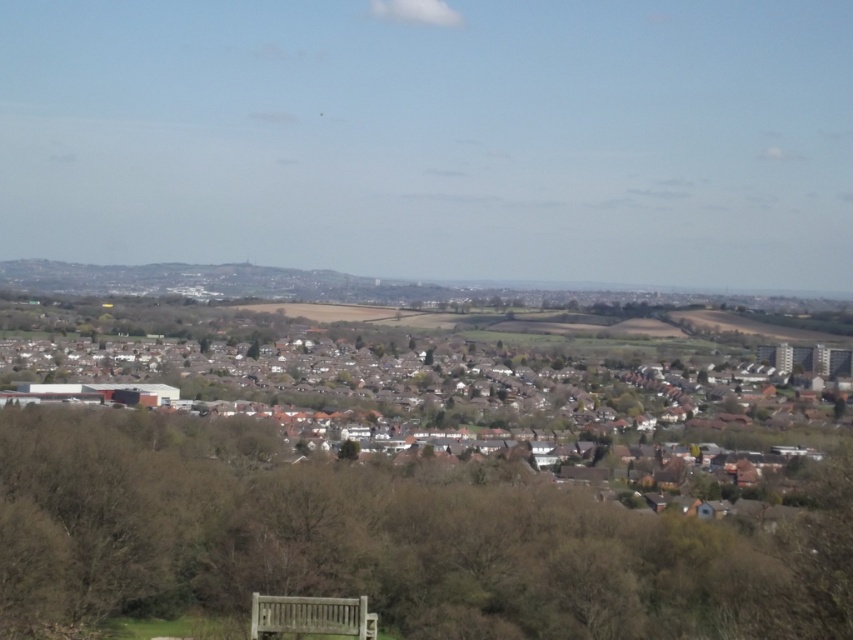
Can you confirm if brown textured bench at lower center is bigger than white matte houses at center?

Incorrect, brown textured bench at lower center is not larger than white matte houses at center.

Can you confirm if brown textured bench at lower center is positioned to the left of white matte houses at center?

Incorrect, brown textured bench at lower center is not on the left side of white matte houses at center.

Is point (76, 598) closer to viewer compared to point (532, 356)?

That is True.

Where is `brown textured bench at lower center`? The width and height of the screenshot is (853, 640). brown textured bench at lower center is located at coordinates (381, 541).

Looking at this image, is white matte houses at center positioned in front of wooden bench at lower center?

No.

Measure the distance between point (x=500, y=394) and camera.

A distance of 131.58 meters exists between point (x=500, y=394) and camera.

In order to click on white matte houses at center in this screenshot , I will do `click(426, 385)`.

Between point (312, 586) and point (297, 609), which one is positioned in front?

Positioned in front is point (297, 609).

Between brown textured bench at lower center and wooden bench at lower center, which one appears on the left side from the viewer's perspective?

wooden bench at lower center

Locate an element on the screen. The image size is (853, 640). brown textured bench at lower center is located at coordinates (381, 541).